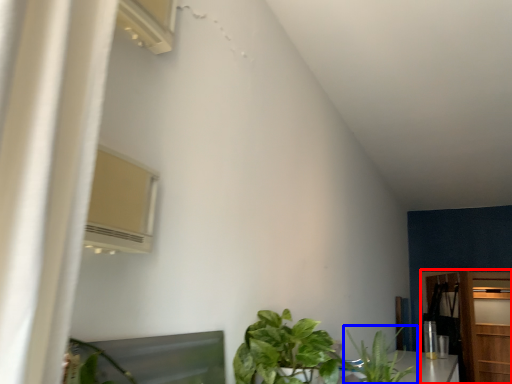
Question: Which point is further to the camera, dresser (highlighted by a red box) or houseplant (highlighted by a blue box)?

Choices:
 (A) dresser
 (B) houseplant

Answer: (A)